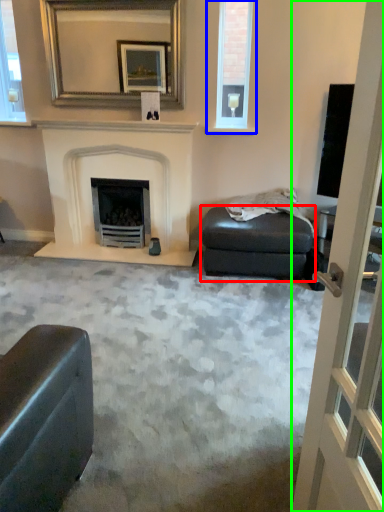
Question: Based on their relative distances, which object is nearer to footrest (highlighted by a red box)? Choose from window (highlighted by a blue box) and screen door (highlighted by a green box).

Choices:
 (A) window
 (B) screen door

Answer: (A)